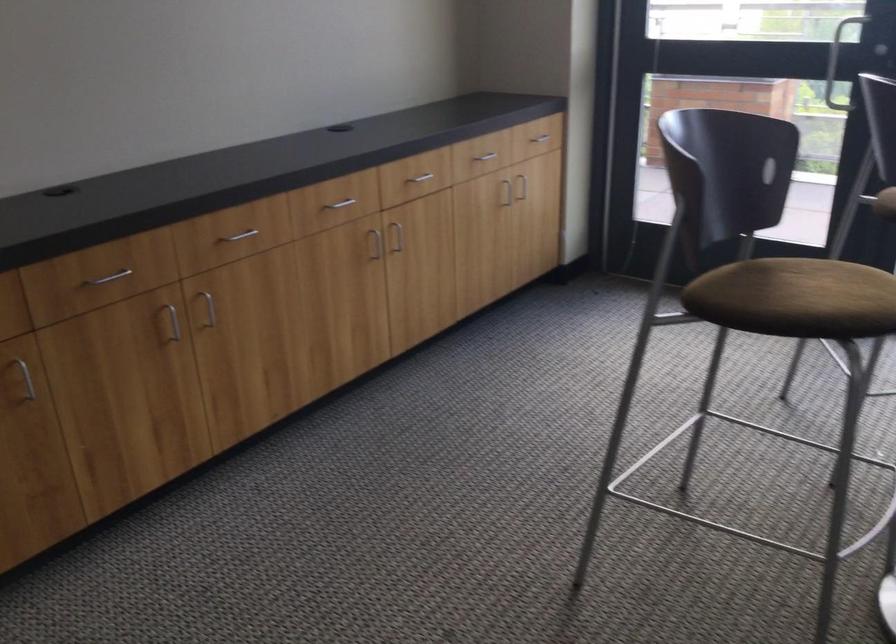
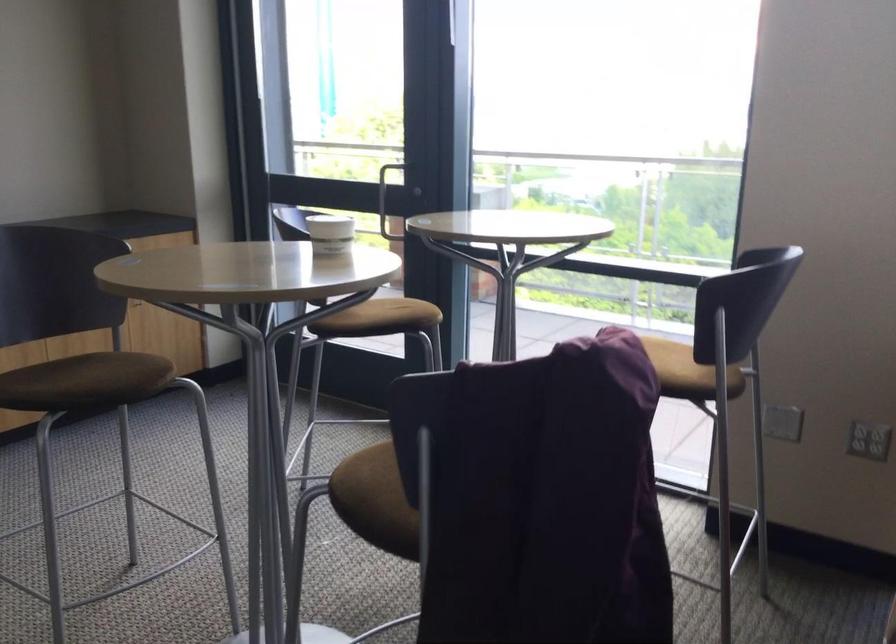
Find the pixel in the second image that matches the point at 729,69 in the first image.

(383, 202)